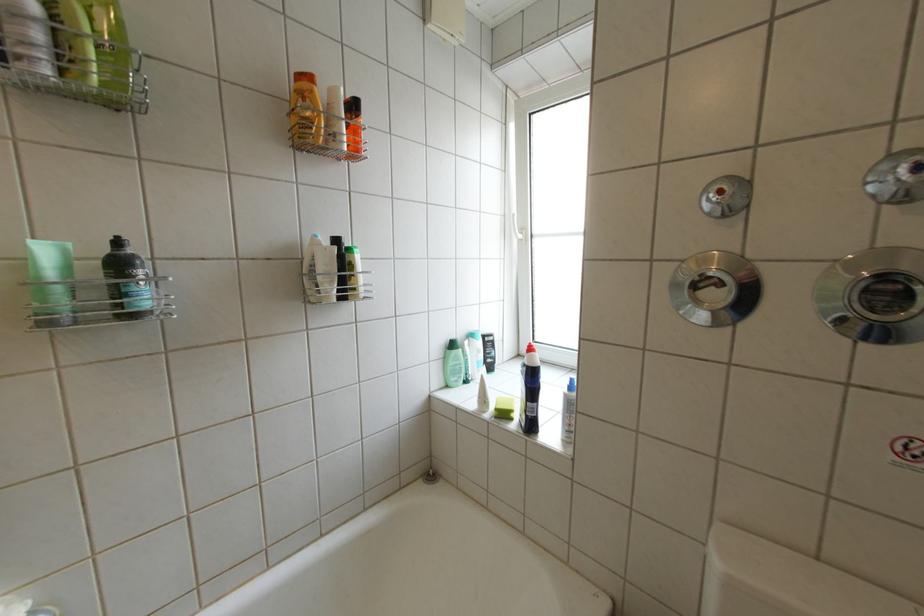
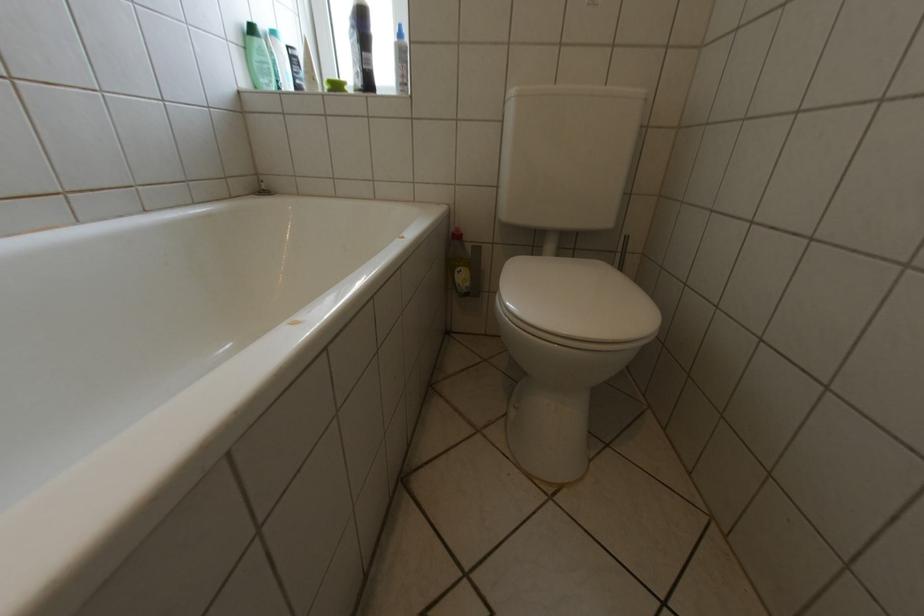
Where in the second image is the point corresponding to (x=464, y=363) from the first image?

(268, 59)